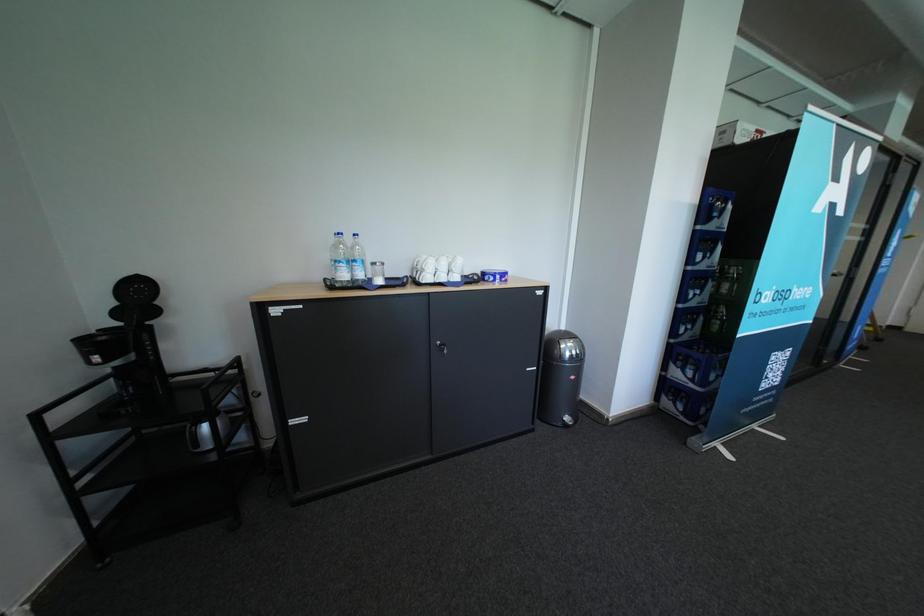
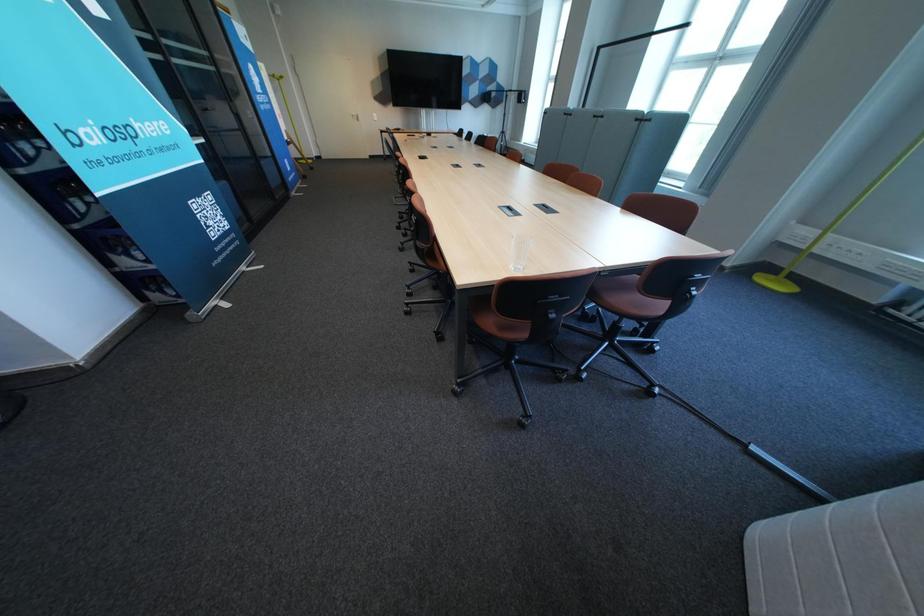
The images are taken continuously from a first-person perspective. In which direction is your viewpoint rotating?

The camera's rotation is toward right-down.